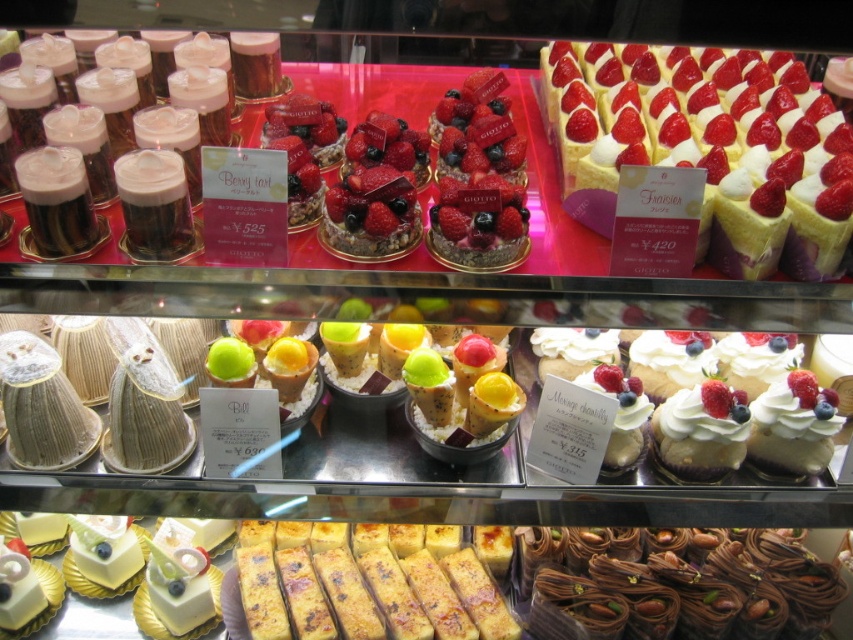
Question: Among these objects, which one is nearest to the camera?

Choices:
 (A) white glossy cake at lower left
 (B) smooth white cream tart at upper right
 (C) golden brown crumbly pastry at center

Answer: (B)

Question: Which is nearer to the white glossy cake at lower left?

Choices:
 (A) smooth white cream tart at upper right
 (B) white cream mousse at center
 (C) chocolate-coated pastry at lower right
 (D) whipped cream topped cupcake at center

Answer: (C)

Question: In this image, where is smooth white cream tart at upper right located relative to golden brown crumbly pastry at center?

Choices:
 (A) right
 (B) left

Answer: (A)

Question: Is smooth white cream tart at upper right in front of white glossy cake at lower left?

Choices:
 (A) no
 (B) yes

Answer: (B)

Question: Where is golden brown crumbly pastry at center located in relation to white cream mousse at center in the image?

Choices:
 (A) above
 (B) below

Answer: (B)

Question: Which point appears closest to the camera in this image?

Choices:
 (A) pyautogui.click(x=444, y=609)
 (B) pyautogui.click(x=770, y=465)
 (C) pyautogui.click(x=390, y=236)

Answer: (C)